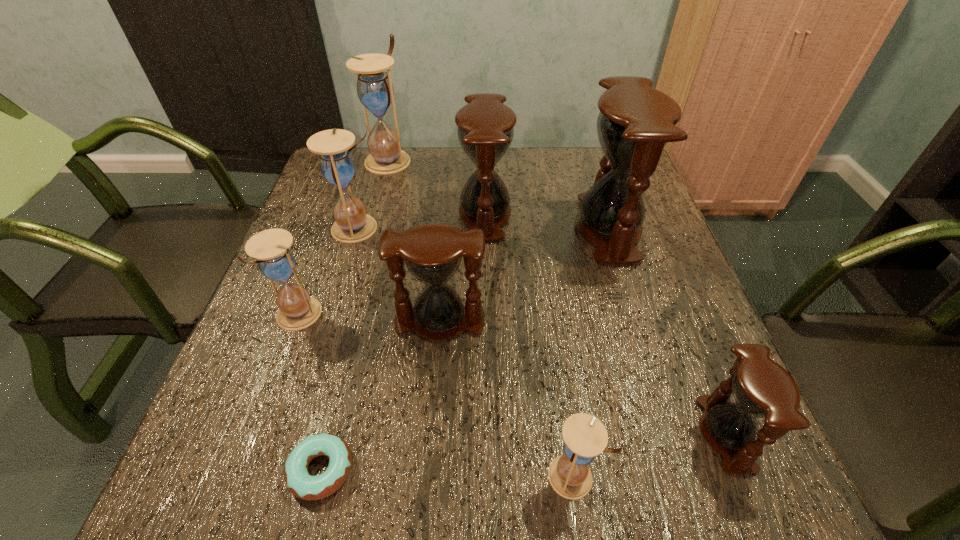
You are a GUI agent. You are given a task and a screenshot of the screen. Output one action in this format:
    pyautogui.click(x=<x>, y=<y>)
    Task: Click on the vacant region at the near right corner of the desktop
    
    Given the screenshot: What is the action you would take?
    pyautogui.click(x=773, y=485)

Where is `vacant space that is in between the biggest white hourglass and the second biggest brown hourglass`? The image size is (960, 540). vacant space that is in between the biggest white hourglass and the second biggest brown hourglass is located at coordinates (437, 187).

The width and height of the screenshot is (960, 540). Find the location of `unoccupied area between the farthest white hourglass and the nearest brown hourglass`. unoccupied area between the farthest white hourglass and the nearest brown hourglass is located at coordinates (557, 297).

This screenshot has width=960, height=540. Identify the location of free space between the blue doughnut and the third smallest brown hourglass. (403, 342).

The width and height of the screenshot is (960, 540). Find the location of `unoccupied area between the nearest brown hourglass and the blue doughnut`. unoccupied area between the nearest brown hourglass and the blue doughnut is located at coordinates (523, 452).

Where is `vacant area that lies between the shortest object and the second biggest brown hourglass`? Image resolution: width=960 pixels, height=540 pixels. vacant area that lies between the shortest object and the second biggest brown hourglass is located at coordinates (403, 342).

Identify the location of free point between the second smallest white hourglass and the shortest object. (310, 393).

Find the location of `free space between the biggest white hourglass and the smallest brown hourglass`. free space between the biggest white hourglass and the smallest brown hourglass is located at coordinates (557, 297).

Where is `free space that is in between the nearest white hourglass and the biggest brown hourglass`? Image resolution: width=960 pixels, height=540 pixels. free space that is in between the nearest white hourglass and the biggest brown hourglass is located at coordinates (590, 353).

At what (x,y) coordinates should I click in order to perform the action: click on object that is the seventh closest to the biggest white hourglass. Please return your answer as a coordinate pair (x, y). The height and width of the screenshot is (540, 960). Looking at the image, I should click on point(585,437).